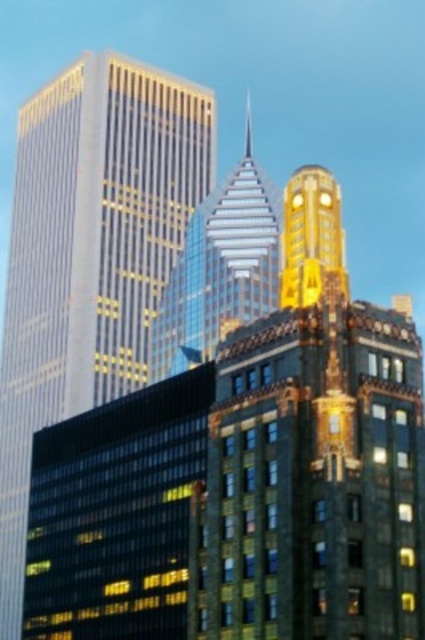
Question: Which point is farther to the camera?

Choices:
 (A) shiny glass skyscraper at center
 (B) gold textured building at center

Answer: (A)

Question: Where is gold glass skyscraper at left located in relation to shiny glass skyscraper at center in the image?

Choices:
 (A) above
 (B) below

Answer: (B)

Question: Which object is closer to the camera taking this photo?

Choices:
 (A) gold textured building at center
 (B) gold glass skyscraper at left

Answer: (A)

Question: Does gold glass skyscraper at left have a lesser width compared to shiny glass skyscraper at center?

Choices:
 (A) yes
 (B) no

Answer: (B)

Question: Which of the following is the closest to the observer?

Choices:
 (A) (x=124, y=300)
 (B) (x=388, y=404)

Answer: (B)

Question: Is gold textured building at center closer to camera compared to gold glass skyscraper at left?

Choices:
 (A) no
 (B) yes

Answer: (B)